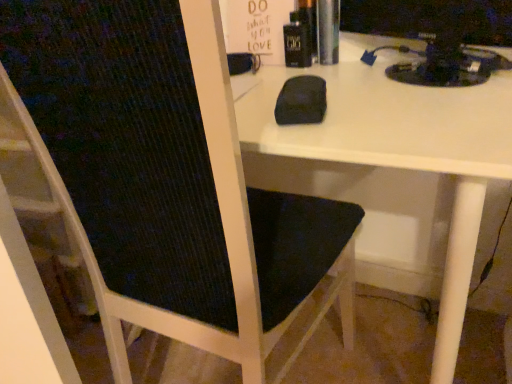
The image size is (512, 384). Find the location of `vacant space underneath black plastic monitor at upper right (from a real-world perspective)`. vacant space underneath black plastic monitor at upper right (from a real-world perspective) is located at coordinates (432, 80).